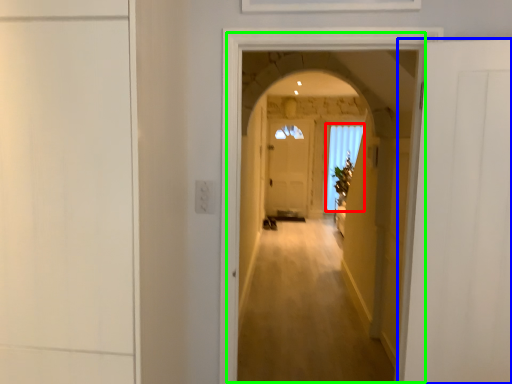
Question: Which object is the closest to the window (highlighted by a red box)? Choose among these: door (highlighted by a blue box) or corridor (highlighted by a green box).

Choices:
 (A) door
 (B) corridor

Answer: (B)